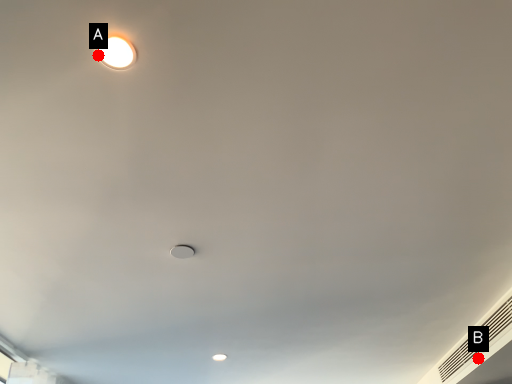
Question: Two points are circled on the image, labeled by A and B beside each circle. Which point is closer to the camera taking this photo?

Choices:
 (A) A is closer
 (B) B is closer

Answer: (A)